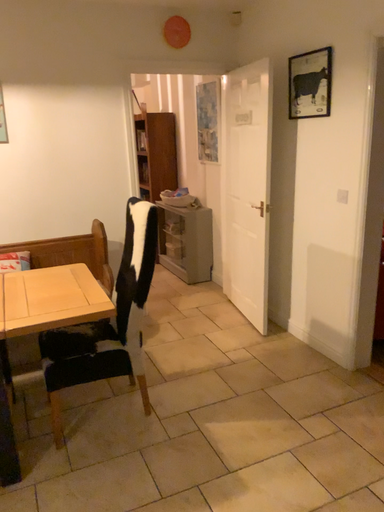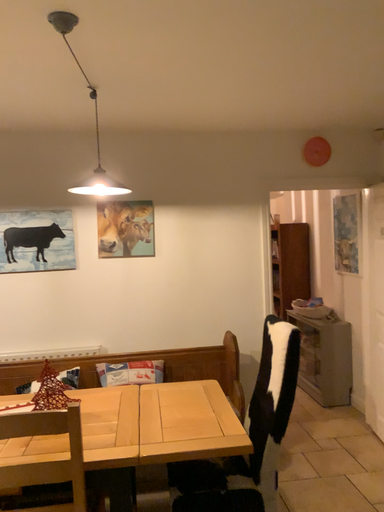
Question: How did the camera likely rotate when shooting the video?

Choices:
 (A) rotated upward
 (B) rotated downward

Answer: (A)